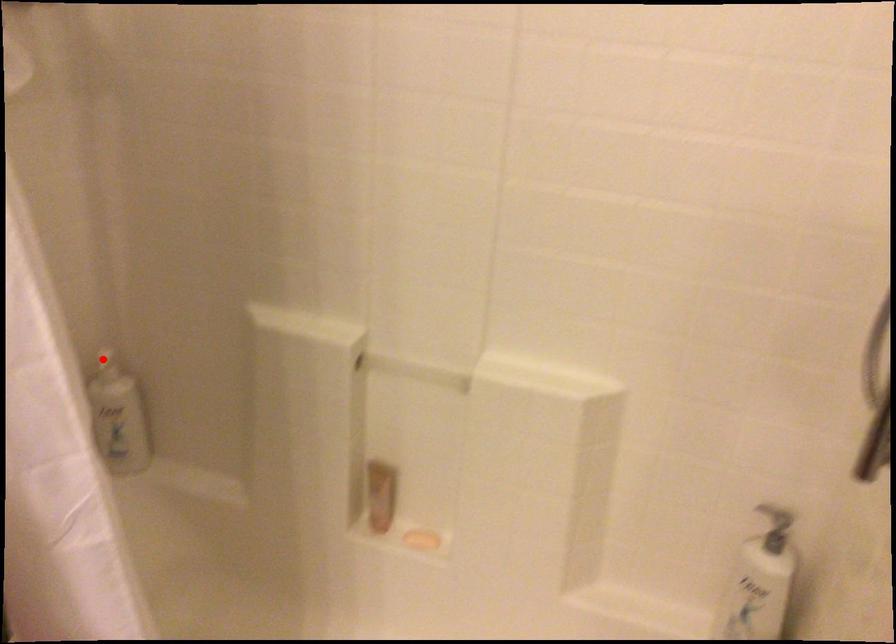
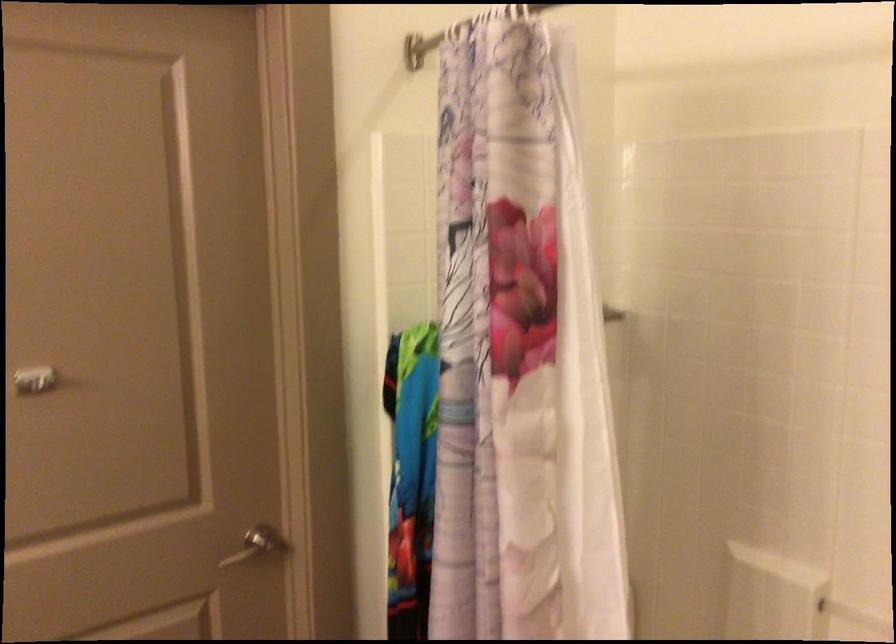
Question: I am providing you with two images of the same scene from different viewpoints. A red point is marked on the first image. At the location where the point appears in image 1, is it still visible in image 2?

Choices:
 (A) Yes
 (B) No

Answer: (B)